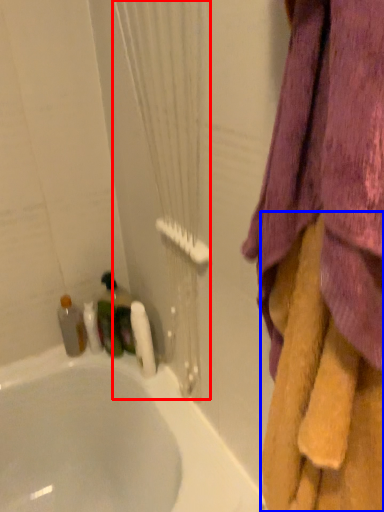
Question: Which of the following is the farthest to the observer, shower curtain (highlighted by a red box) or towel (highlighted by a blue box)?

Choices:
 (A) shower curtain
 (B) towel

Answer: (A)